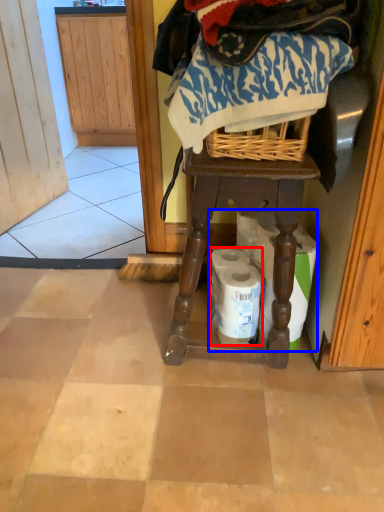
Question: Among these objects, which one is nearest to the camera, toilet paper (highlighted by a red box) or toilet paper (highlighted by a blue box)?

Choices:
 (A) toilet paper
 (B) toilet paper

Answer: (B)